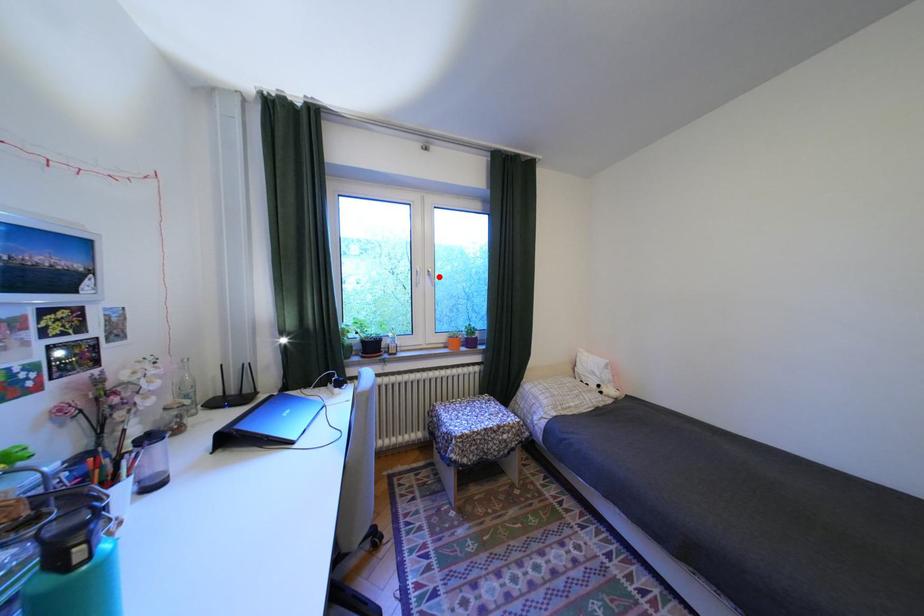
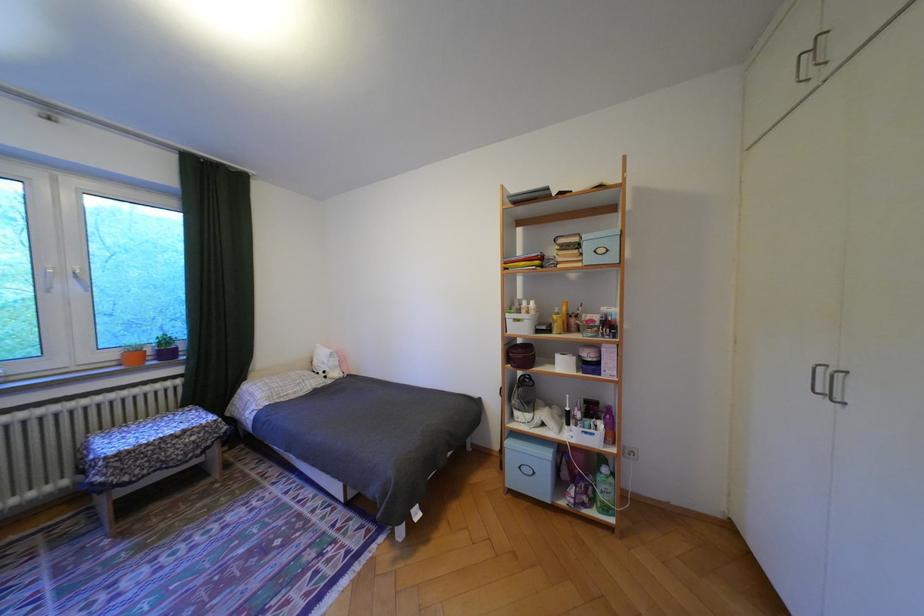
Find the pixel in the second image that matches the highlighted location in the first image.

(84, 280)